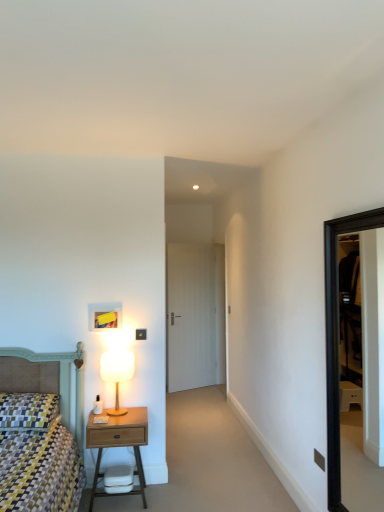
Question: Can you confirm if matte black switch at upper center is bigger than patterned fabric pillow at lower left?

Choices:
 (A) no
 (B) yes

Answer: (A)

Question: From a real-world perspective, is matte black switch at upper center physically below patterned fabric pillow at lower left?

Choices:
 (A) yes
 (B) no

Answer: (A)

Question: Can you confirm if matte black switch at upper center is positioned to the right of patterned fabric pillow at lower left?

Choices:
 (A) yes
 (B) no

Answer: (A)

Question: Would you say patterned fabric pillow at lower left is part of matte black switch at upper center's contents?

Choices:
 (A) no
 (B) yes

Answer: (A)

Question: Is matte black switch at upper center positioned far away from patterned fabric pillow at lower left?

Choices:
 (A) no
 (B) yes

Answer: (B)

Question: From the image's perspective, is matte black switch at upper center over patterned fabric pillow at lower left?

Choices:
 (A) yes
 (B) no

Answer: (B)

Question: Can you confirm if matte white lamp at left is wider than wooden nightstand at lower left?

Choices:
 (A) yes
 (B) no

Answer: (B)

Question: Is matte white lamp at left next to wooden nightstand at lower left?

Choices:
 (A) no
 (B) yes

Answer: (A)

Question: Is matte white lamp at left further to the viewer compared to wooden nightstand at lower left?

Choices:
 (A) yes
 (B) no

Answer: (A)

Question: Considering the relative sizes of matte white lamp at left and wooden nightstand at lower left in the image provided, is matte white lamp at left thinner than wooden nightstand at lower left?

Choices:
 (A) no
 (B) yes

Answer: (B)

Question: Can you confirm if matte white lamp at left is bigger than wooden nightstand at lower left?

Choices:
 (A) yes
 (B) no

Answer: (B)

Question: Is matte white lamp at left in front of wooden nightstand at lower left?

Choices:
 (A) no
 (B) yes

Answer: (A)

Question: Is wooden nightstand at lower left taller than white wood door at center?

Choices:
 (A) yes
 (B) no

Answer: (B)